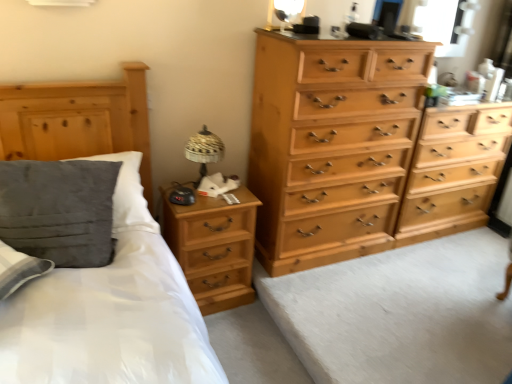
Question: In the image, is light wood chest of drawers at center right, marked as the 1th chest of drawers in a right-to-left arrangement, positioned in front of or behind light brown wood dresser at center?

Choices:
 (A) behind
 (B) front

Answer: (A)

Question: From their relative heights in the image, would you say light wood chest of drawers at center right, marked as the 1th chest of drawers in a right-to-left arrangement, is taller or shorter than light brown wood dresser at center?

Choices:
 (A) tall
 (B) short

Answer: (A)

Question: Which of these objects is positioned closest to the matte gold table lamp at upper center, which is the 1th table lamp from top to bottom?

Choices:
 (A) transparent glass window at upper right
 (B) woven fabric table lamp at upper right, which appears as the first table lamp when viewed from the left
 (C) light brown wood nightstand at lower left
 (D) light brown wood dresser at center
 (E) suede-like gray pillow at left

Answer: (B)

Question: Estimate the real-world distances between objects in this image. Which object is closer to the velvety gray pillow at left?

Choices:
 (A) light brown wood dresser at center
 (B) woven fabric table lamp at upper right, which appears as the first table lamp when viewed from the left
 (C) light wood chest of drawers at right, the 1th chest of drawers when ordered from left to right
 (D) light wood chest of drawers at center right, positioned as the second chest of drawers in left-to-right order
 (E) matte gold table lamp at upper center, marked as the first table lamp in a right-to-left arrangement

Answer: (B)